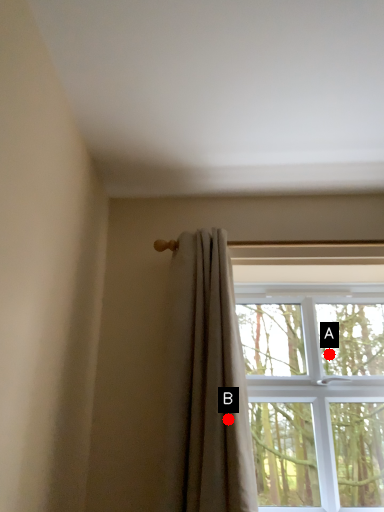
Question: Two points are circled on the image, labeled by A and B beside each circle. Among these points, which one is nearest to the camera?

Choices:
 (A) A is closer
 (B) B is closer

Answer: (B)